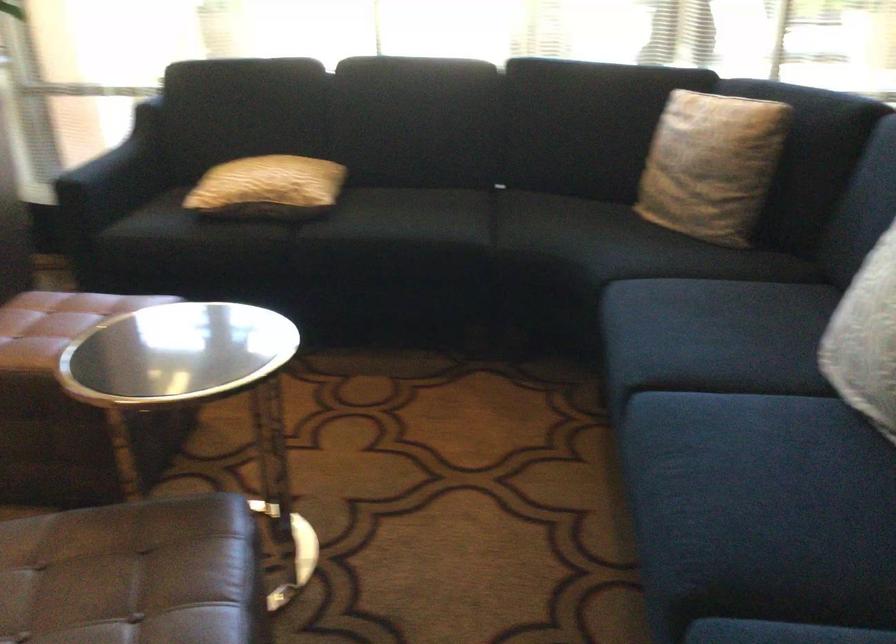
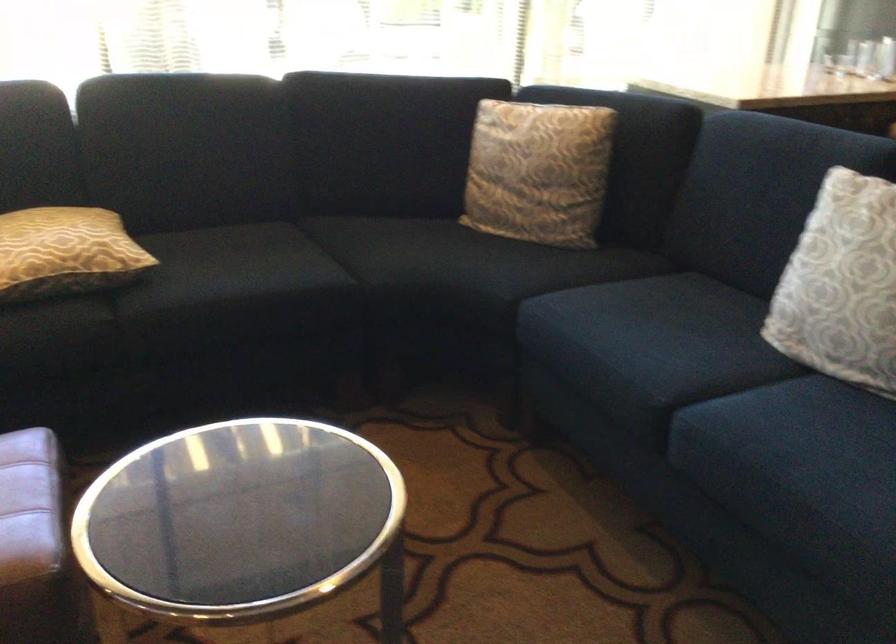
In the second image, find the point that corresponds to point 702,161 in the first image.

(538, 172)